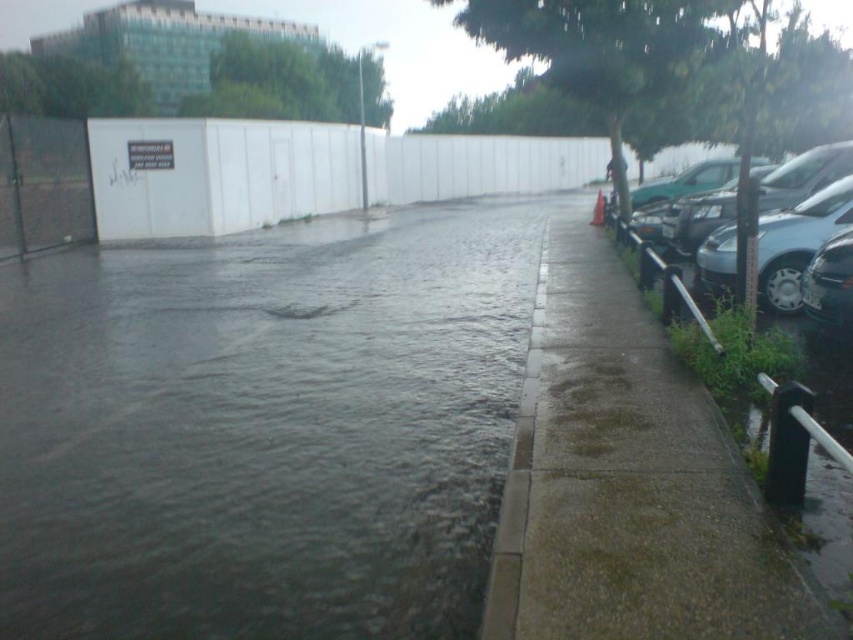
Question: Is satin silver car at right further to the viewer compared to shiny black car at right?

Choices:
 (A) no
 (B) yes

Answer: (B)

Question: Can you confirm if dark wet pavement at center is bigger than green matte car at right?

Choices:
 (A) yes
 (B) no

Answer: (B)

Question: Observing the image, what is the correct spatial positioning of satin silver car at right in reference to gray concrete curb at center?

Choices:
 (A) left
 (B) right

Answer: (B)

Question: Among these objects, which one is farthest from the camera?

Choices:
 (A) gray concrete curb at center
 (B) green matte car at right

Answer: (B)

Question: Which is farther from the gray concrete curb at center?

Choices:
 (A) green matte car at right
 (B) dark wet pavement at center

Answer: (A)

Question: Which point appears farthest from the camera in this image?

Choices:
 (A) (228, 634)
 (B) (701, 180)
 (C) (517, 600)

Answer: (B)